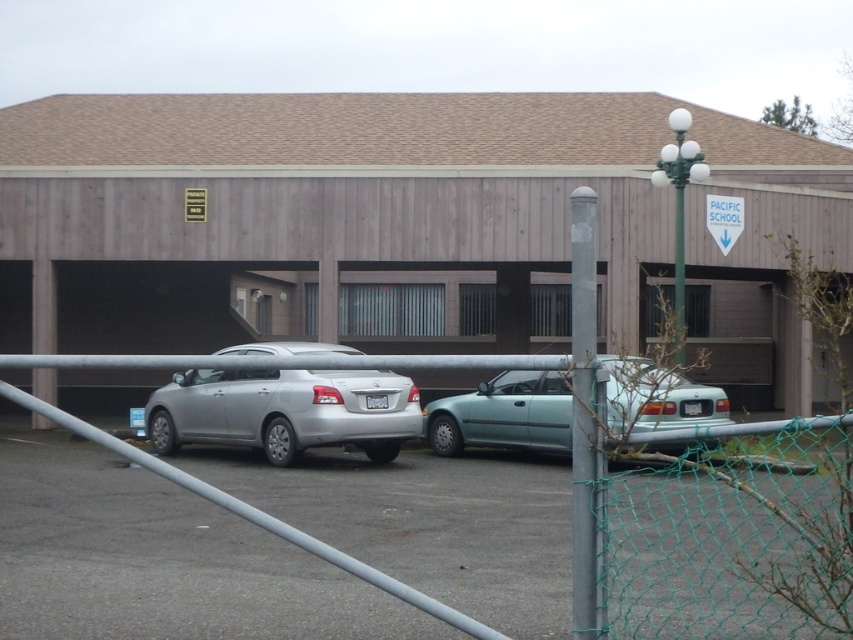
Question: Is green chain-link fence at lower right below white plastic sign at upper center?

Choices:
 (A) yes
 (B) no

Answer: (A)

Question: Considering the real-world distances, which object is closest to the smooth gray pole at right?

Choices:
 (A) green chain-link fence at lower right
 (B) light blue matte car at center
 (C) silver metallic sedan at center
 (D) white plastic sign at upper center

Answer: (A)

Question: Considering the relative positions of silver metallic sedan at center and light blue matte car at center in the image provided, where is silver metallic sedan at center located with respect to light blue matte car at center?

Choices:
 (A) above
 (B) below

Answer: (B)

Question: Which object is farther from the camera taking this photo?

Choices:
 (A) smooth gray pole at right
 (B) light blue matte car at center

Answer: (A)

Question: Among these points, which one is farthest from the camera?

Choices:
 (A) (537, 428)
 (B) (407, 429)
 (C) (107, 232)
 (D) (584, 440)

Answer: (C)

Question: From the image, what is the correct spatial relationship of light blue matte car at center in relation to white plastic sign at upper center?

Choices:
 (A) right
 (B) left

Answer: (B)